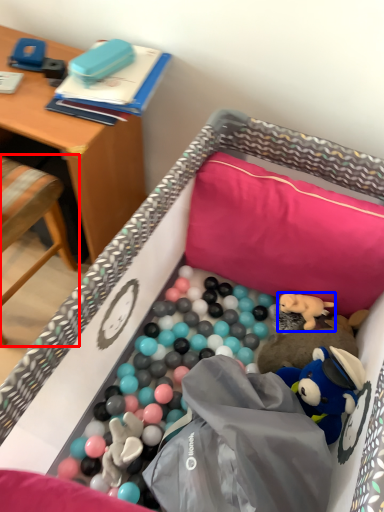
Question: Which object is further to the camera taking this photo, chair (highlighted by a red box) or toy (highlighted by a blue box)?

Choices:
 (A) chair
 (B) toy

Answer: (B)